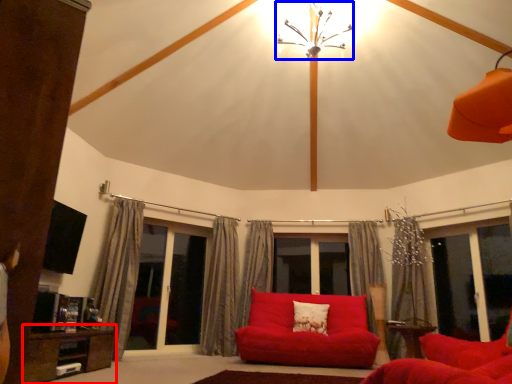
Question: Which object appears closest to the camera in this image, table (highlighted by a red box) or light fixture (highlighted by a blue box)?

Choices:
 (A) table
 (B) light fixture

Answer: (A)